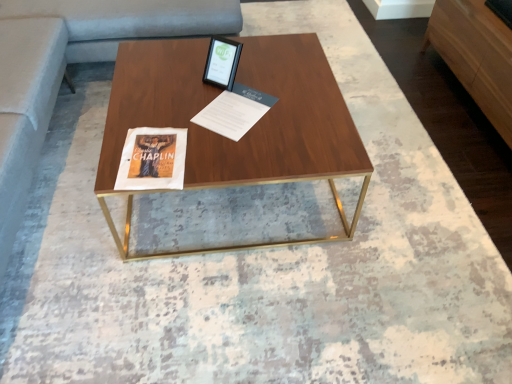
Question: Is walnut wood coffee table at center closer to the viewer compared to matte black tablet at upper center?

Choices:
 (A) no
 (B) yes

Answer: (B)

Question: Could matte black tablet at upper center be considered to be inside walnut wood coffee table at center?

Choices:
 (A) no
 (B) yes

Answer: (A)

Question: From the image's perspective, is walnut wood coffee table at center on matte black tablet at upper center?

Choices:
 (A) no
 (B) yes

Answer: (A)

Question: From the image's perspective, is walnut wood coffee table at center below matte black tablet at upper center?

Choices:
 (A) yes
 (B) no

Answer: (A)

Question: Considering the relative sizes of walnut wood coffee table at center and matte black tablet at upper center in the image provided, is walnut wood coffee table at center taller than matte black tablet at upper center?

Choices:
 (A) no
 (B) yes

Answer: (B)

Question: Considering their positions, is light brown wood dresser at right located in front of or behind walnut wood coffee table at center?

Choices:
 (A) front
 (B) behind

Answer: (B)

Question: From a real-world perspective, relative to walnut wood coffee table at center, is light brown wood dresser at right vertically above or below?

Choices:
 (A) above
 (B) below

Answer: (A)

Question: In terms of height, does light brown wood dresser at right look taller or shorter compared to walnut wood coffee table at center?

Choices:
 (A) tall
 (B) short

Answer: (A)

Question: Is light brown wood dresser at right bigger or smaller than walnut wood coffee table at center?

Choices:
 (A) big
 (B) small

Answer: (B)

Question: From the image's perspective, is matte black tablet at upper center above or below walnut wood coffee table at center?

Choices:
 (A) below
 (B) above

Answer: (B)

Question: Is matte black tablet at upper center to the left or to the right of walnut wood coffee table at center in the image?

Choices:
 (A) left
 (B) right

Answer: (A)

Question: Is matte black tablet at upper center taller or shorter than walnut wood coffee table at center?

Choices:
 (A) short
 (B) tall

Answer: (A)

Question: Is matte black tablet at upper center bigger or smaller than walnut wood coffee table at center?

Choices:
 (A) big
 (B) small

Answer: (B)

Question: Considering the positions of point (230, 102) and point (480, 77), is point (230, 102) closer or farther from the camera than point (480, 77)?

Choices:
 (A) farther
 (B) closer

Answer: (B)

Question: From a real-world perspective, relative to light brown wood dresser at right, is white paper at center vertically above or below?

Choices:
 (A) above
 (B) below

Answer: (A)